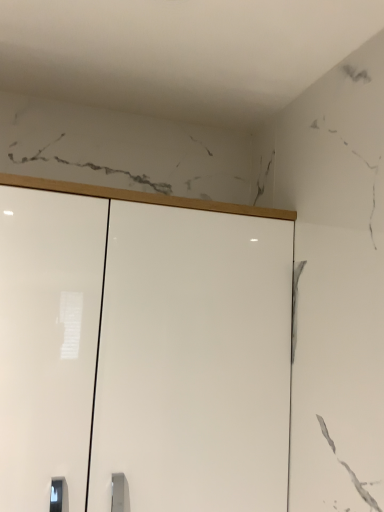
What do you see at coordinates (142, 352) in the screenshot? I see `glossy white cupboard at center` at bounding box center [142, 352].

Locate an element on the screen. glossy white cupboard at center is located at coordinates (142, 352).

Where is `glossy white cupboard at center`? glossy white cupboard at center is located at coordinates (142, 352).